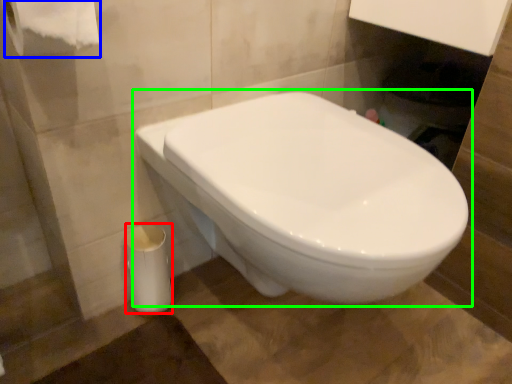
Question: Considering the real-world distances, which object is farthest from porcelain (highlighted by a red box)? toilet paper (highlighted by a blue box) or toilet (highlighted by a green box)?

Choices:
 (A) toilet paper
 (B) toilet

Answer: (A)